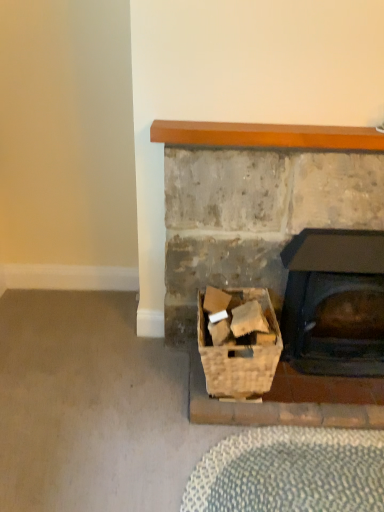
Question: Is point (256, 387) positioned closer to the camera than point (248, 208)?

Choices:
 (A) closer
 (B) farther

Answer: (A)

Question: Considering the positions of woven wood basket at lower center and rustic stone fireplace at lower right in the image, is woven wood basket at lower center wider or thinner than rustic stone fireplace at lower right?

Choices:
 (A) thin
 (B) wide

Answer: (B)

Question: Which of these objects is positioned closest to the rustic stone fireplace at lower right?

Choices:
 (A) wooden mantel at upper center
 (B) black matte wood burning stove at center right
 (C) woven wood basket at lower center

Answer: (B)

Question: Estimate the real-world distances between objects in this image. Which object is farther from the wooden mantel at upper center?

Choices:
 (A) woven wood basket at lower center
 (B) rustic stone fireplace at lower right
 (C) black matte wood burning stove at center right

Answer: (A)